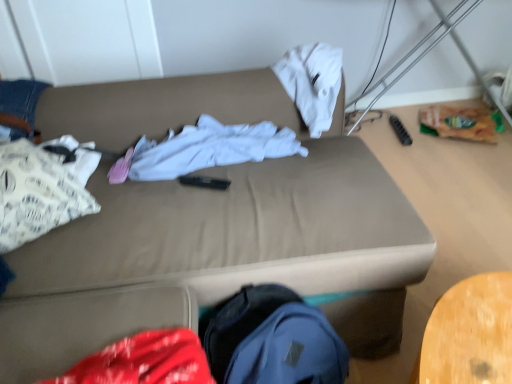
Question: From a real-world perspective, is white cotton shirt at center, which appears as the first clothing when viewed from the right, located higher than white paper bag at left, which is the first clothing in left-to-right order?

Choices:
 (A) no
 (B) yes

Answer: (A)

Question: Is white cotton shirt at center, which appears as the first clothing when viewed from the right, aimed at white paper bag at left, which is the first clothing in left-to-right order?

Choices:
 (A) yes
 (B) no

Answer: (B)

Question: Does white cotton shirt at center, which appears as the first clothing when viewed from the right, have a smaller size compared to white paper bag at left, arranged as the 2th clothing when viewed from the right?

Choices:
 (A) no
 (B) yes

Answer: (A)

Question: Does white cotton shirt at center, which appears as the first clothing when viewed from the right, have a greater height compared to white paper bag at left, which is the first clothing in left-to-right order?

Choices:
 (A) no
 (B) yes

Answer: (A)

Question: Considering the relative positions of white cotton shirt at center, which is the second clothing from left to right, and white paper bag at left, which is the first clothing in left-to-right order, in the image provided, is white cotton shirt at center, which is the second clothing from left to right, in front of white paper bag at left, which is the first clothing in left-to-right order,?

Choices:
 (A) no
 (B) yes

Answer: (A)

Question: Visually, is beige fabric couch at center positioned to the left or to the right of white paper bag at left, which is the first clothing in left-to-right order?

Choices:
 (A) right
 (B) left

Answer: (A)

Question: Is beige fabric couch at center inside or outside of white paper bag at left, arranged as the 2th clothing when viewed from the right?

Choices:
 (A) inside
 (B) outside

Answer: (B)

Question: Relative to white paper bag at left, arranged as the 2th clothing when viewed from the right, is beige fabric couch at center in front or behind?

Choices:
 (A) behind
 (B) front

Answer: (B)

Question: Considering the positions of beige fabric couch at center and white paper bag at left, which is the first clothing in left-to-right order, in the image, is beige fabric couch at center wider or thinner than white paper bag at left, which is the first clothing in left-to-right order,?

Choices:
 (A) wide
 (B) thin

Answer: (A)

Question: Is beige fabric couch at center in front of or behind white cotton shirt at center, which appears as the first clothing when viewed from the right, in the image?

Choices:
 (A) behind
 (B) front

Answer: (B)

Question: From a real-world perspective, is beige fabric couch at center above or below white cotton shirt at center, which is the second clothing from left to right?

Choices:
 (A) below
 (B) above

Answer: (A)

Question: Would you say beige fabric couch at center is inside or outside white cotton shirt at center, which appears as the first clothing when viewed from the right?

Choices:
 (A) outside
 (B) inside

Answer: (A)

Question: From the image's perspective, is beige fabric couch at center located above or below white cotton shirt at center, which is the second clothing from left to right?

Choices:
 (A) below
 (B) above

Answer: (A)

Question: Would you say white paper bag at left, arranged as the 2th clothing when viewed from the right, is to the left or to the right of beige fabric couch at center in the picture?

Choices:
 (A) left
 (B) right

Answer: (A)

Question: From their relative heights in the image, would you say white paper bag at left, which is the first clothing in left-to-right order, is taller or shorter than beige fabric couch at center?

Choices:
 (A) tall
 (B) short

Answer: (B)